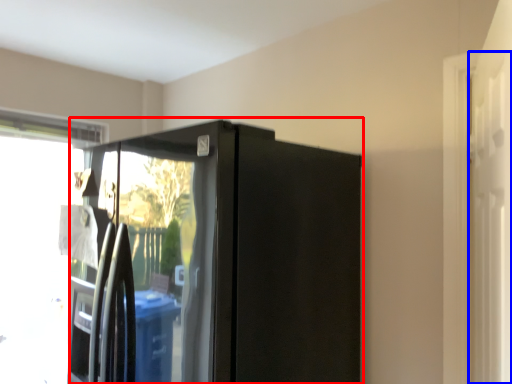
Question: Which object appears farthest to the camera in this image, appliance (highlighted by a red box) or screen door (highlighted by a blue box)?

Choices:
 (A) appliance
 (B) screen door

Answer: (A)